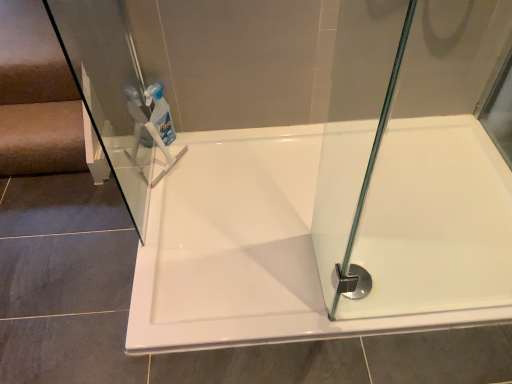
Question: In terms of width, does transparent plastic bottle at upper center look wider or thinner when compared to polished chrome shower at bottom right?

Choices:
 (A) thin
 (B) wide

Answer: (A)

Question: From a real-world perspective, is transparent plastic bottle at upper center positioned above or below polished chrome shower at bottom right?

Choices:
 (A) above
 (B) below

Answer: (A)

Question: Which of these objects is positioned closest to the white glossy bathtub at center?

Choices:
 (A) polished chrome shower at bottom right
 (B) transparent plastic bottle at upper center

Answer: (A)

Question: Which is nearer to the transparent plastic bottle at upper center?

Choices:
 (A) polished chrome shower at bottom right
 (B) white glossy bathtub at center

Answer: (B)